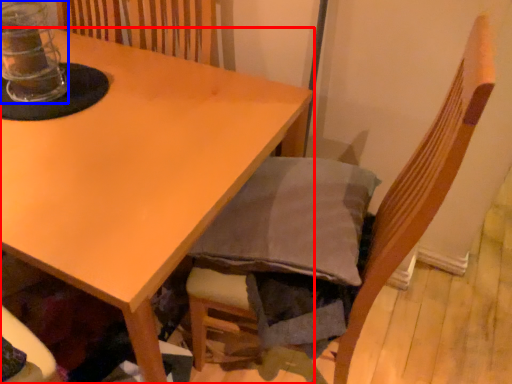
Question: Which of the following is the farthest to the observer, table (highlighted by a red box) or glass jar (highlighted by a blue box)?

Choices:
 (A) table
 (B) glass jar

Answer: (B)